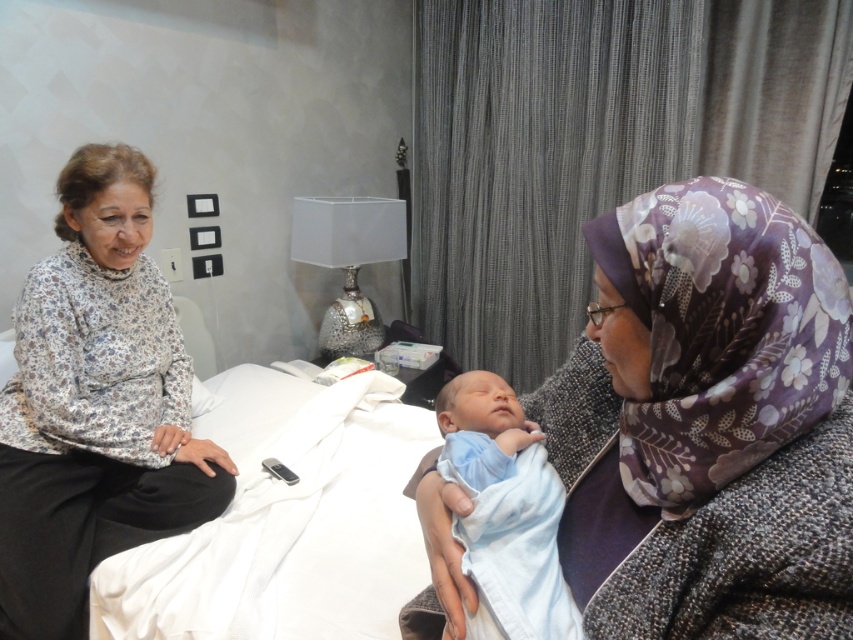
Question: Which object is the closest to the purple floral headscarf at upper right?

Choices:
 (A) white fabric bed at center
 (B) floral-patterned fabric at left

Answer: (A)

Question: Which point is closer to the camera?

Choices:
 (A) pyautogui.click(x=786, y=332)
 (B) pyautogui.click(x=286, y=404)
 (C) pyautogui.click(x=114, y=541)

Answer: (A)

Question: From the image, what is the correct spatial relationship of purple floral headscarf at upper right in relation to blue soft fabric baby at center?

Choices:
 (A) above
 (B) below

Answer: (A)

Question: Does purple floral headscarf at upper right have a greater width compared to floral-patterned fabric at left?

Choices:
 (A) no
 (B) yes

Answer: (A)

Question: Is white fabric bed at center further to camera compared to blue soft fabric baby at center?

Choices:
 (A) no
 (B) yes

Answer: (B)

Question: Among these points, which one is farthest from the camera?

Choices:
 (A) click(x=38, y=436)
 (B) click(x=286, y=461)

Answer: (B)